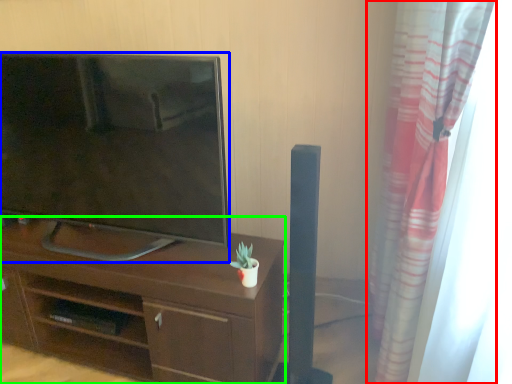
Question: Which object is positioned farthest from curtain (highlighted by a red box)? Select from television (highlighted by a blue box) and desk (highlighted by a green box).

Choices:
 (A) television
 (B) desk

Answer: (A)